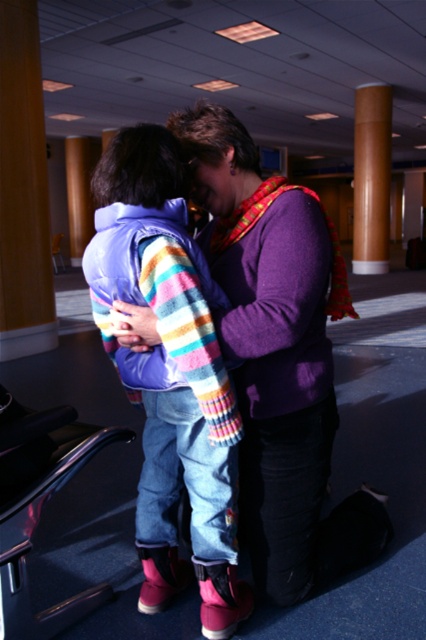
This screenshot has height=640, width=426. What do you see at coordinates (279, 356) in the screenshot?
I see `purple soft sweater at center` at bounding box center [279, 356].

Is purple soft sweater at center further to the viewer compared to rainbow striped sweater at center?

Yes.

Is point (258, 324) farther from viewer compared to point (166, 570)?

That is False.

Image resolution: width=426 pixels, height=640 pixels. Identify the location of purple soft sweater at center. tap(279, 356).

Who is higher up, rainbow striped sweater at center or brown wooden chair at center?

brown wooden chair at center

Can you confirm if rainbow striped sweater at center is positioned above brown wooden chair at center?

Incorrect, rainbow striped sweater at center is not positioned above brown wooden chair at center.

Which is behind, point (216, 624) or point (54, 237)?

Positioned behind is point (54, 237).

Where is `rainbow striped sweater at center`? rainbow striped sweater at center is located at coordinates (169, 372).

Who is more distant from viewer, (322, 227) or (57, 252)?

The point (57, 252) is more distant.

Describe the element at coordinates (279, 356) in the screenshot. This screenshot has height=640, width=426. I see `purple soft sweater at center` at that location.

The image size is (426, 640). Describe the element at coordinates (279, 356) in the screenshot. I see `purple soft sweater at center` at that location.

Identify the location of purple soft sweater at center. (279, 356).